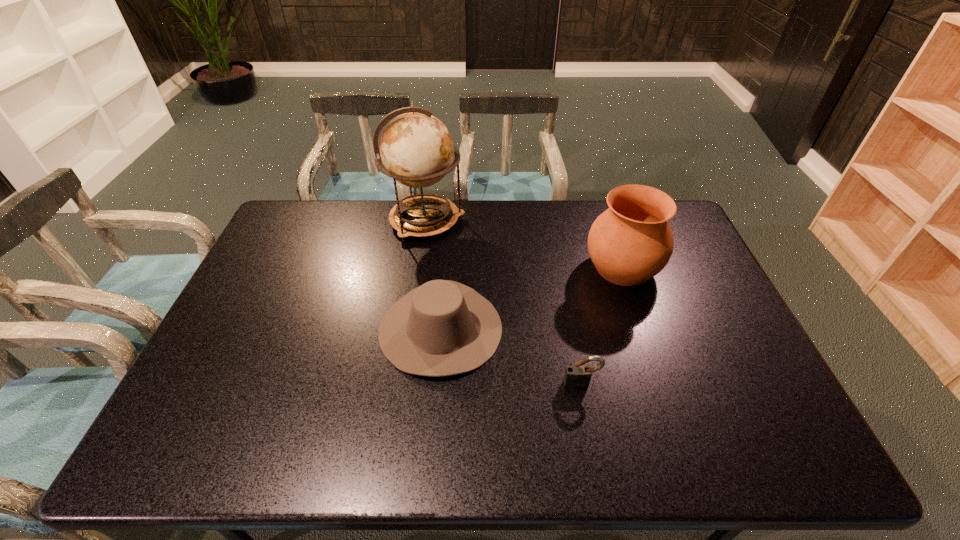
The width and height of the screenshot is (960, 540). In order to click on globe in this screenshot , I will do `click(416, 148)`.

Find the location of a particular element. The width and height of the screenshot is (960, 540). the third shortest object is located at coordinates (629, 243).

Find the location of a particular element. The width and height of the screenshot is (960, 540). the rightmost object is located at coordinates (629, 243).

Locate an element on the screen. The width and height of the screenshot is (960, 540). cowboy hat is located at coordinates (441, 328).

Identify the location of the third object from left to right. This screenshot has width=960, height=540. (578, 376).

I want to click on vacant space located at the center of the globe, so click(x=481, y=221).

The width and height of the screenshot is (960, 540). I want to click on vacant point located on the left of the rightmost object, so click(485, 268).

Find the location of a particular element. This screenshot has width=960, height=540. vacant region located 0.330m on the right of the cowboy hat is located at coordinates (618, 328).

Find the location of a particular element. The height and width of the screenshot is (540, 960). vacant point located with the keyhole on the front of the third object from left to right is located at coordinates (595, 459).

Locate an element on the screen. object that is at the far edge is located at coordinates (416, 148).